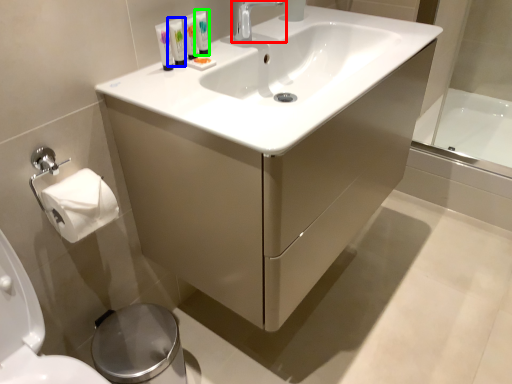
Question: Which object is positioned farthest from tap (highlighted by a red box)? Select from mouthwash (highlighted by a blue box) and mouthwash (highlighted by a green box).

Choices:
 (A) mouthwash
 (B) mouthwash

Answer: (A)